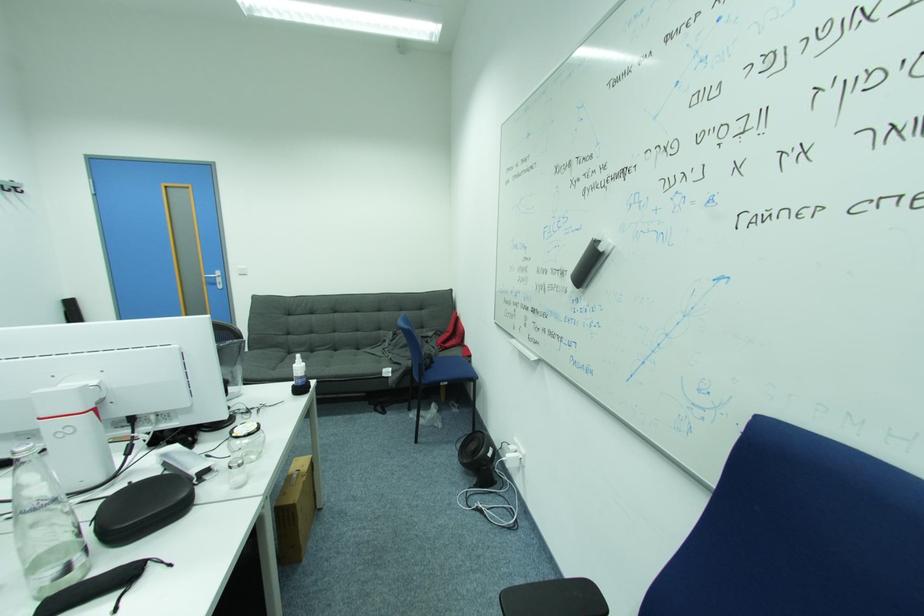
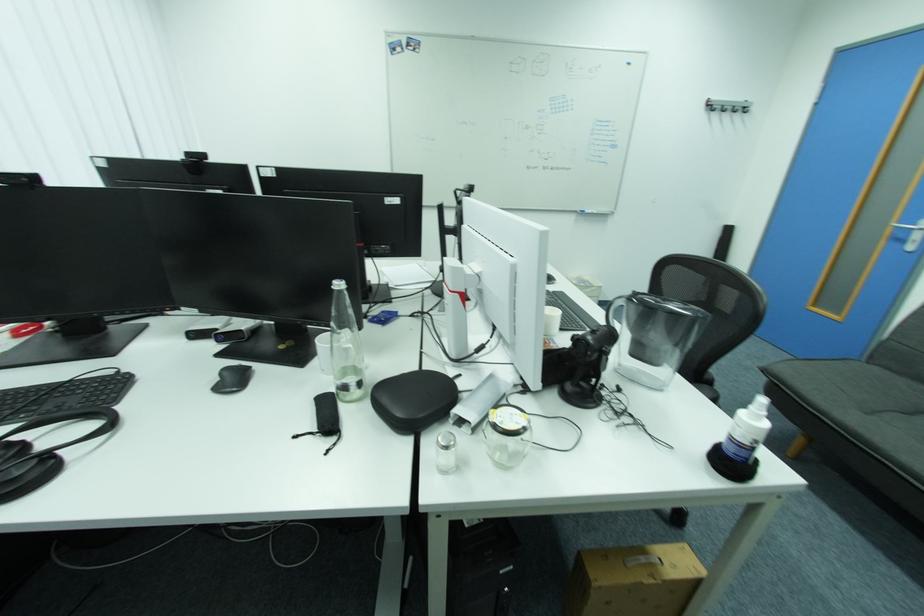
Where in the second image is the point corresponding to the point at 298,504 from the first image?

(597, 576)